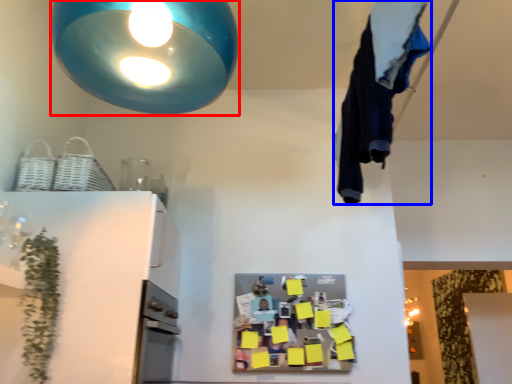
Question: Which of the following is the farthest to the observer, lamp (highlighted by a red box) or laundry (highlighted by a blue box)?

Choices:
 (A) lamp
 (B) laundry

Answer: (B)